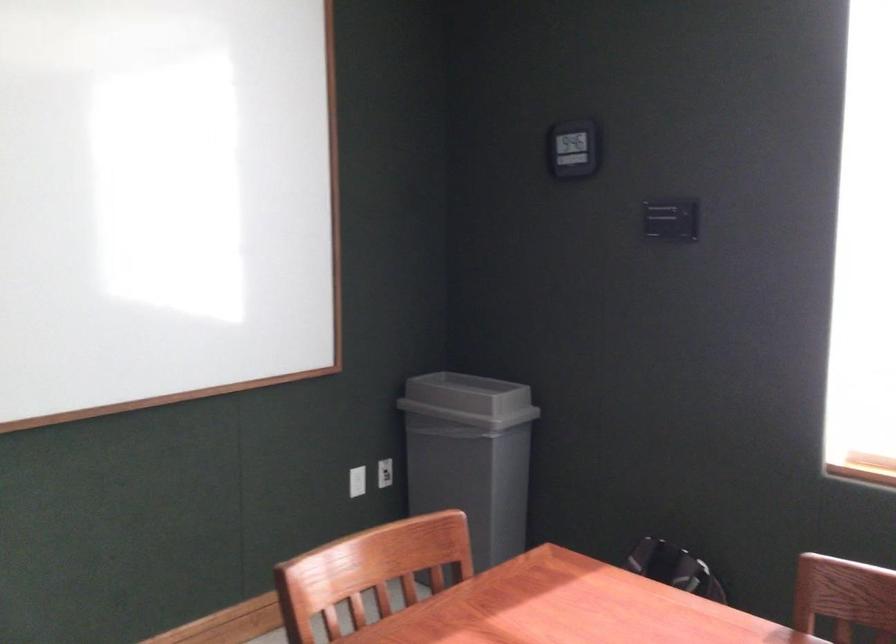
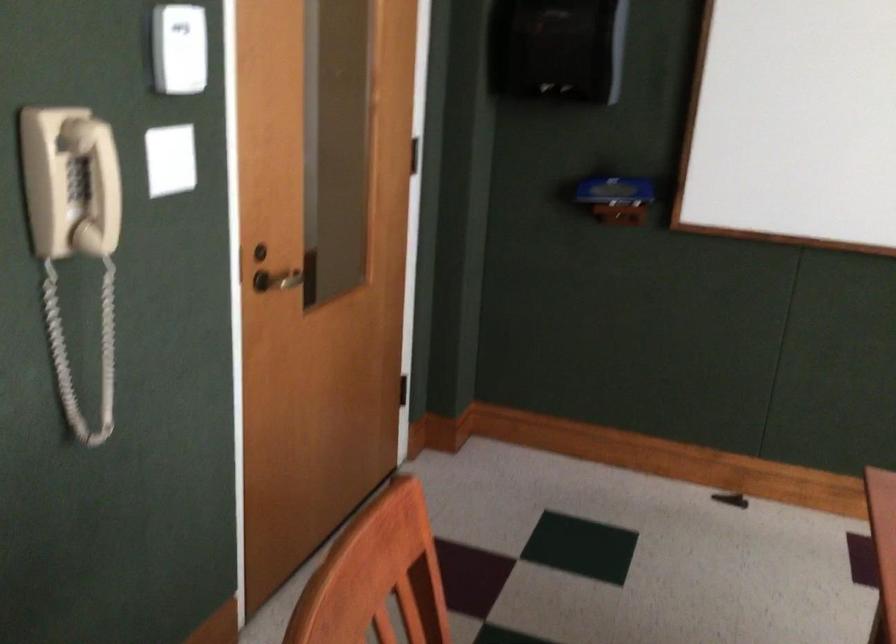
Question: How did the camera likely rotate?

Choices:
 (A) Left
 (B) Right
 (C) Up
 (D) Down

Answer: (A)